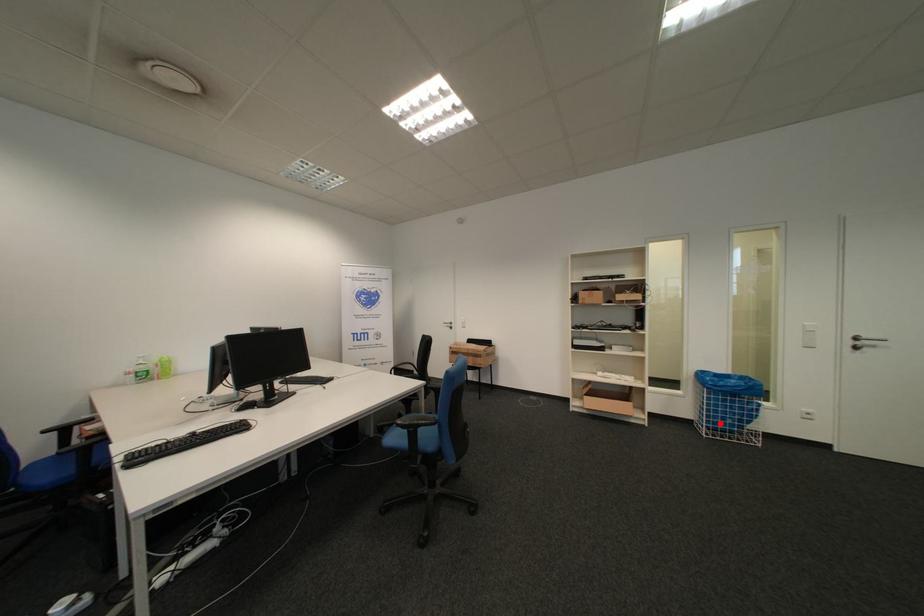
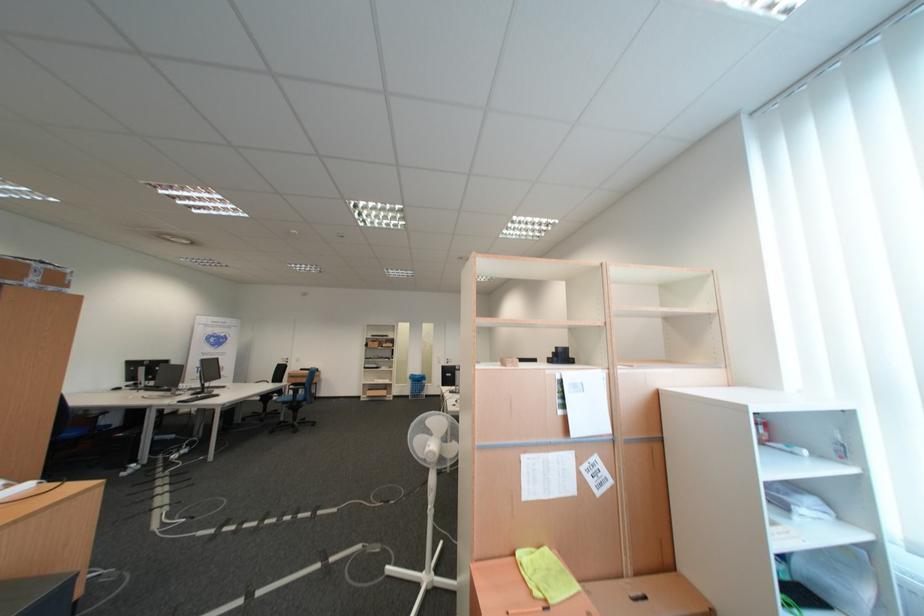
Question: I am providing you with two images of the same scene from different viewpoints. A red point is marked on the first image. Is the red point's position out of view in image 2?

Choices:
 (A) Yes
 (B) No

Answer: (B)